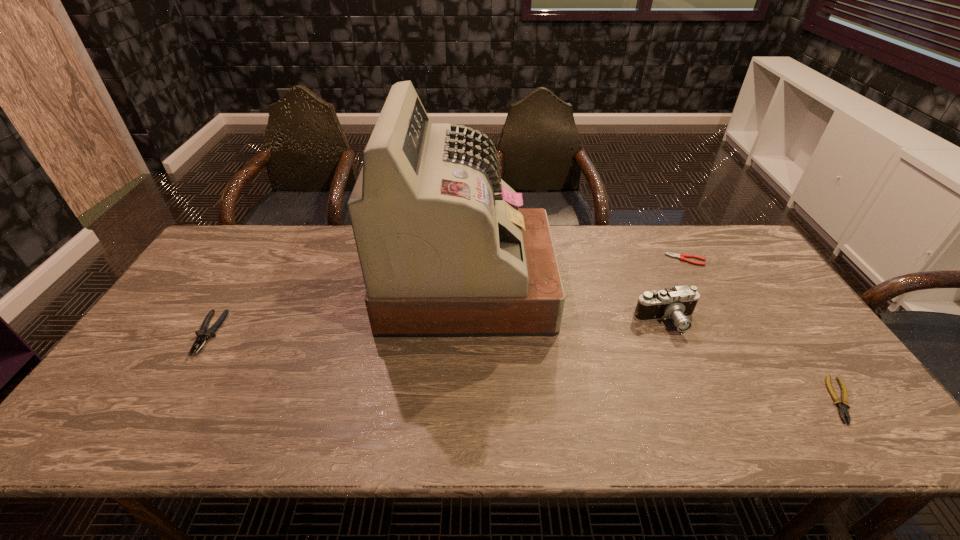
In order to click on blank region between the tallest object and the third shortest object in this screenshot , I will do `click(338, 309)`.

Locate an element on the screen. free space between the rightmost pliers and the third object from left to right is located at coordinates (754, 361).

Identify the location of free spot between the second pliers from right to left and the fourth object from right to left. The height and width of the screenshot is (540, 960). (577, 272).

You are a GUI agent. You are given a task and a screenshot of the screen. Output one action in this format:
    pyautogui.click(x=<x>, y=<y>)
    Task: Click on the free space between the nearest object and the second object from right to left
    This screenshot has width=960, height=540.
    Given the screenshot: What is the action you would take?
    pyautogui.click(x=763, y=330)

Find the location of a particular element. free point between the fourth shortest object and the nearest object is located at coordinates (754, 361).

Choose which object is the second nearest neighbor to the fourth object from right to left. Please provide its 2D coordinates. Your answer should be formatted as a tuple, i.e. [(x, y)], where the tuple contains the x and y coordinates of a point satisfying the conditions above.

[(681, 256)]

Choose which object is the second nearest neighbor to the second farthest pliers. Please provide its 2D coordinates. Your answer should be formatted as a tuple, i.e. [(x, y)], where the tuple contains the x and y coordinates of a point satisfying the conditions above.

[(678, 303)]

Locate which pliers ranks in proximity to the second farthest pliers. Please provide its 2D coordinates. Your answer should be formatted as a tuple, i.e. [(x, y)], where the tuple contains the x and y coordinates of a point satisfying the conditions above.

[(681, 256)]

Identify which pliers is the nearest to the third object from right to left. Please provide its 2D coordinates. Your answer should be formatted as a tuple, i.e. [(x, y)], where the tuple contains the x and y coordinates of a point satisfying the conditions above.

[(681, 256)]

Find the location of `blank area in the image that satisfies the following two spatial constraints: 1. on the operating side of the cash register; 2. on the back side of the rightmost pliers`. blank area in the image that satisfies the following two spatial constraints: 1. on the operating side of the cash register; 2. on the back side of the rightmost pliers is located at coordinates (464, 400).